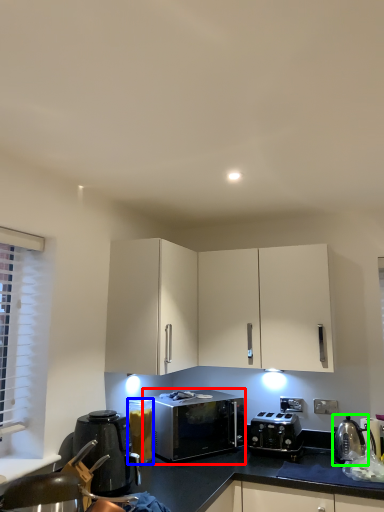
Question: Based on their relative distances, which object is nearer to microwave oven (highlighted by a red box)? Choose from appliance (highlighted by a blue box) and appliance (highlighted by a green box).

Choices:
 (A) appliance
 (B) appliance

Answer: (A)